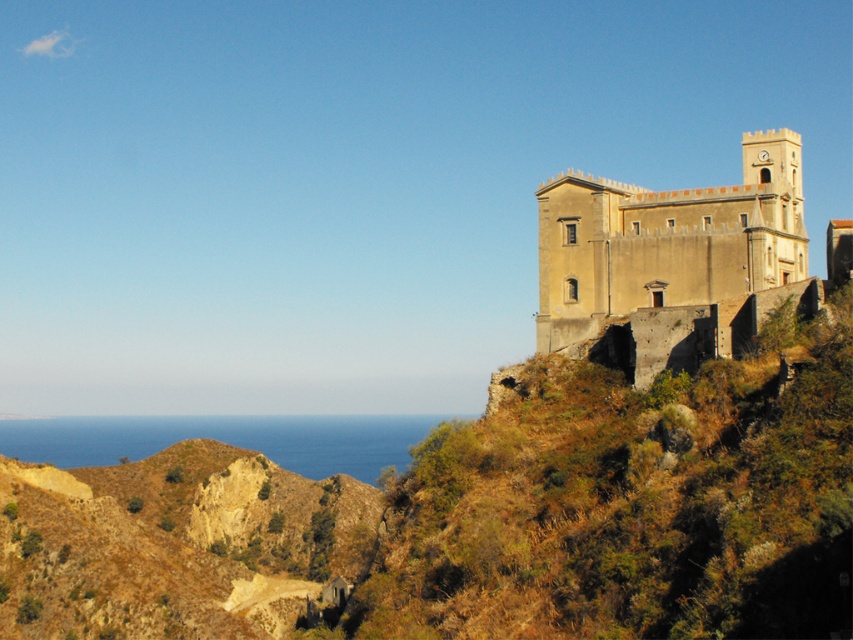
Is brown rocky hill at lower left to the left of beige stone fort at upper right from the viewer's perspective?

Indeed, brown rocky hill at lower left is positioned on the left side of beige stone fort at upper right.

Can you confirm if brown rocky hill at lower left is shorter than beige stone fort at upper right?

Correct, brown rocky hill at lower left is not as tall as beige stone fort at upper right.

Does point (219, 573) lie behind point (572, 280)?

Yes, it is.

The image size is (853, 640). What are the coordinates of `brown rocky hill at lower left` in the screenshot? It's located at (173, 545).